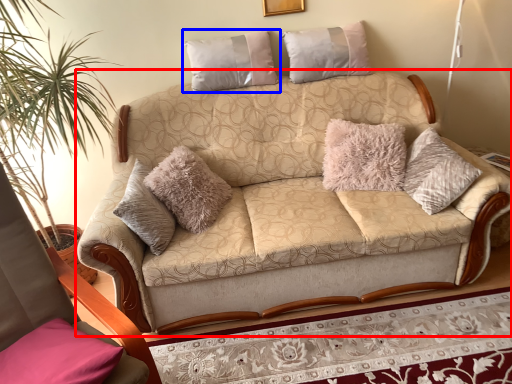
Question: Which object appears closest to the camera in this image, studio couch (highlighted by a red box) or pillow (highlighted by a blue box)?

Choices:
 (A) studio couch
 (B) pillow

Answer: (A)